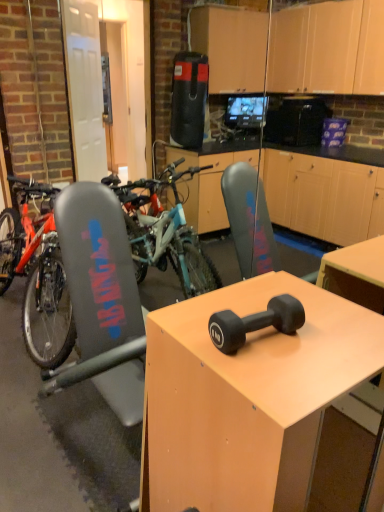
Question: Is black rubber dumbbell at center positioned in front of matte black dumbbell at center?

Choices:
 (A) yes
 (B) no

Answer: (B)

Question: Is black rubber dumbbell at center looking in the opposite direction of matte black dumbbell at center?

Choices:
 (A) no
 (B) yes

Answer: (A)

Question: Is black rubber dumbbell at center smaller than matte black dumbbell at center?

Choices:
 (A) yes
 (B) no

Answer: (A)

Question: Is black rubber dumbbell at center to the right of matte black dumbbell at center from the viewer's perspective?

Choices:
 (A) no
 (B) yes

Answer: (A)

Question: Is black rubber dumbbell at center with matte black dumbbell at center?

Choices:
 (A) no
 (B) yes

Answer: (A)

Question: Looking at their shapes, would you say teal matte mountain bike at left is wider or thinner than black rubber dumbbell at center?

Choices:
 (A) wide
 (B) thin

Answer: (A)

Question: Is teal matte mountain bike at left inside or outside of black rubber dumbbell at center?

Choices:
 (A) inside
 (B) outside

Answer: (B)

Question: From a real-world perspective, is teal matte mountain bike at left above or below black rubber dumbbell at center?

Choices:
 (A) below
 (B) above

Answer: (A)

Question: Considering the positions of teal matte mountain bike at left and black rubber dumbbell at center in the image, is teal matte mountain bike at left bigger or smaller than black rubber dumbbell at center?

Choices:
 (A) big
 (B) small

Answer: (A)

Question: From the image's perspective, is teal matte mountain bike at left above or below matte black dumbbell at center?

Choices:
 (A) above
 (B) below

Answer: (A)

Question: Is teal matte mountain bike at left spatially inside matte black dumbbell at center, or outside of it?

Choices:
 (A) inside
 (B) outside

Answer: (B)

Question: In terms of width, does teal matte mountain bike at left look wider or thinner when compared to matte black dumbbell at center?

Choices:
 (A) thin
 (B) wide

Answer: (B)

Question: Visually, is teal matte mountain bike at left positioned to the left or to the right of matte black dumbbell at center?

Choices:
 (A) right
 (B) left

Answer: (B)

Question: From the image's perspective, is matte black dumbbell at center above or below black rubber dumbbell at center?

Choices:
 (A) above
 (B) below

Answer: (B)

Question: Is matte black dumbbell at center in front of or behind black rubber dumbbell at center in the image?

Choices:
 (A) behind
 (B) front

Answer: (B)